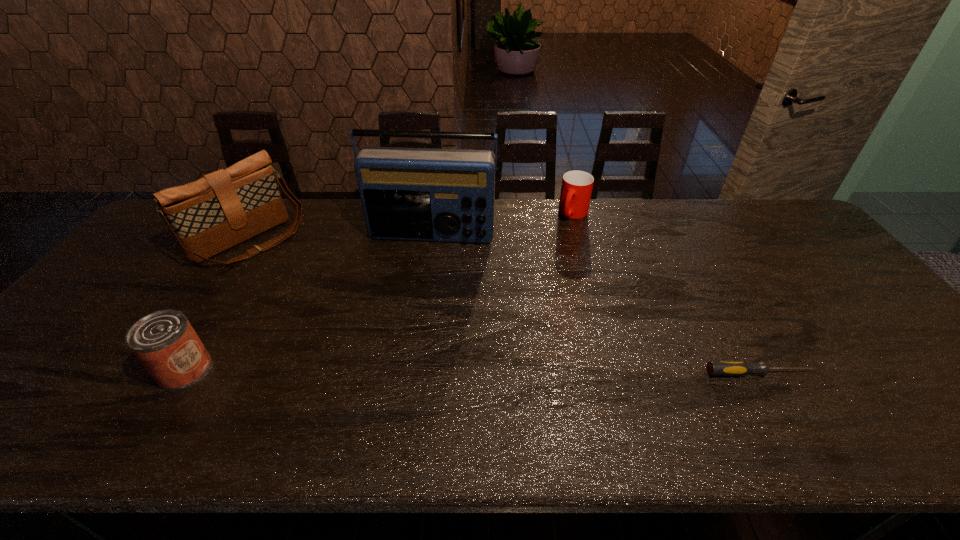
Locate an element on the screen. free space on the desktop that is between the can and the screwdriver and is positioned on the front panel of the tallest object is located at coordinates (398, 370).

Image resolution: width=960 pixels, height=540 pixels. Find the location of `vacant space on the desktop that is between the can and the screwdriver and is positioned on the side of the cup with the handle`. vacant space on the desktop that is between the can and the screwdriver and is positioned on the side of the cup with the handle is located at coordinates (459, 371).

Locate an element on the screen. The image size is (960, 540). vacant space on the desktop that is between the can and the rightmost object and is positioned on the front-facing side of the fourth shortest object is located at coordinates (408, 370).